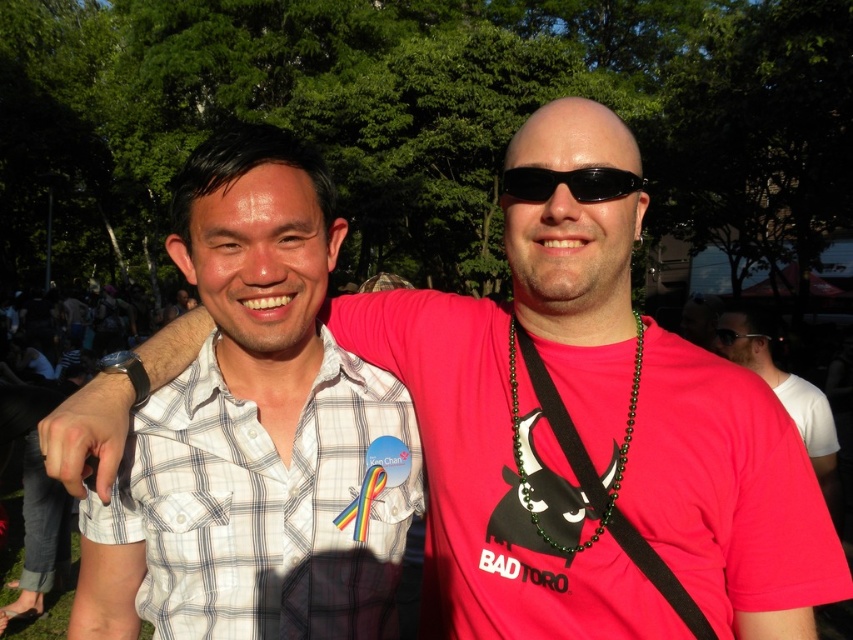
Is white checkered shirt at left shorter than black plastic sunglasses at center?

Incorrect, white checkered shirt at left's height does not fall short of black plastic sunglasses at center's.

Does point (196, 440) come behind point (593, 189)?

Yes, point (196, 440) is farther from viewer.

Does point (257, 586) lie behind point (532, 170)?

Yes, it is.

Where is `white checkered shirt at left`? This screenshot has width=853, height=640. white checkered shirt at left is located at coordinates (267, 506).

Between white checkered shirt at left and matte pink shirt at center, which one has more height?

matte pink shirt at center

Which of these two, white checkered shirt at left or matte pink shirt at center, stands shorter?

white checkered shirt at left is shorter.

Locate an element on the screen. This screenshot has width=853, height=640. white checkered shirt at left is located at coordinates (267, 506).

What do you see at coordinates (782, 388) in the screenshot? The height and width of the screenshot is (640, 853). I see `matte pink shirt at center` at bounding box center [782, 388].

Does point (834, 444) lie in front of point (601, 166)?

No, it is not.

You are a GUI agent. You are given a task and a screenshot of the screen. Output one action in this format:
    pyautogui.click(x=<x>, y=<y>)
    Task: Click on the matte pink shirt at center
    
    Given the screenshot: What is the action you would take?
    pyautogui.click(x=782, y=388)